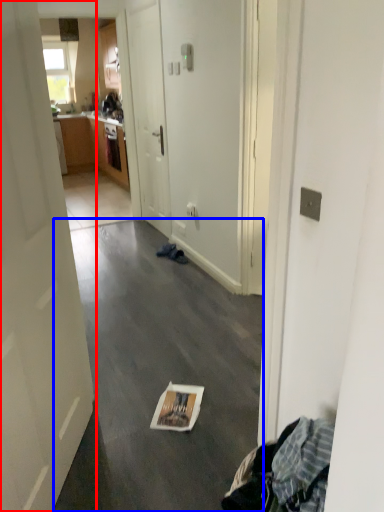
Question: Which point is further to the camera, door (highlighted by a red box) or concrete (highlighted by a blue box)?

Choices:
 (A) door
 (B) concrete

Answer: (B)